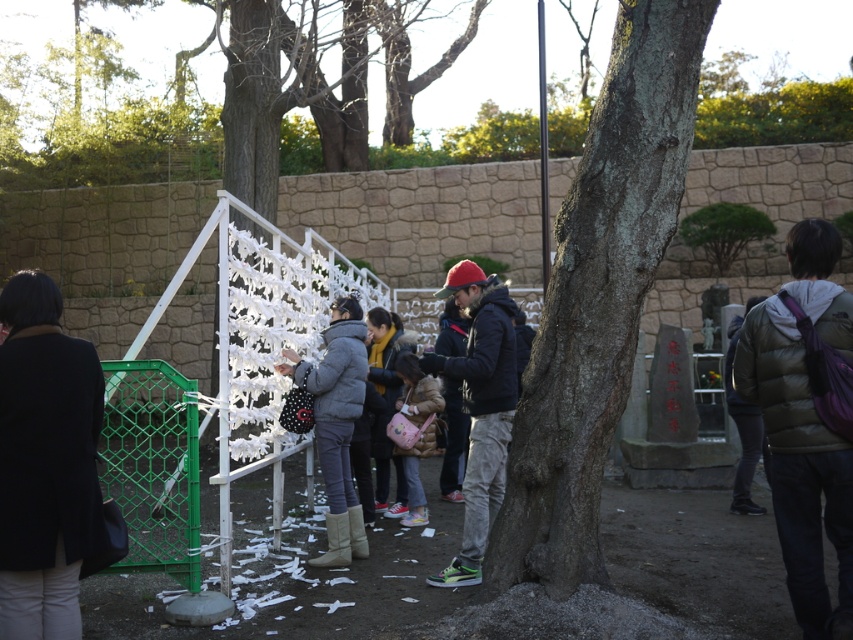
You are a visitor at the park and see the black wool coat at left and the green mesh gate at lower left. Which object is higher up in the image?

The black wool coat at left is above the green mesh gate at lower left, so it is higher up in the image.

You are standing in the park scene and want to place a small decoration between the two points, point (45, 604) and point (173, 426). Which point should the decoration be closer to in order to appear larger in the image?

The decoration should be placed closer to point (45, 604) because it is closer to the camera, making objects placed there appear larger in the image.

You are standing in the park scene described. There is a green puffy jacket at right. Where exactly is the green puffy jacket located in terms of coordinates?

The green puffy jacket at right is located at coordinates point (799,467).